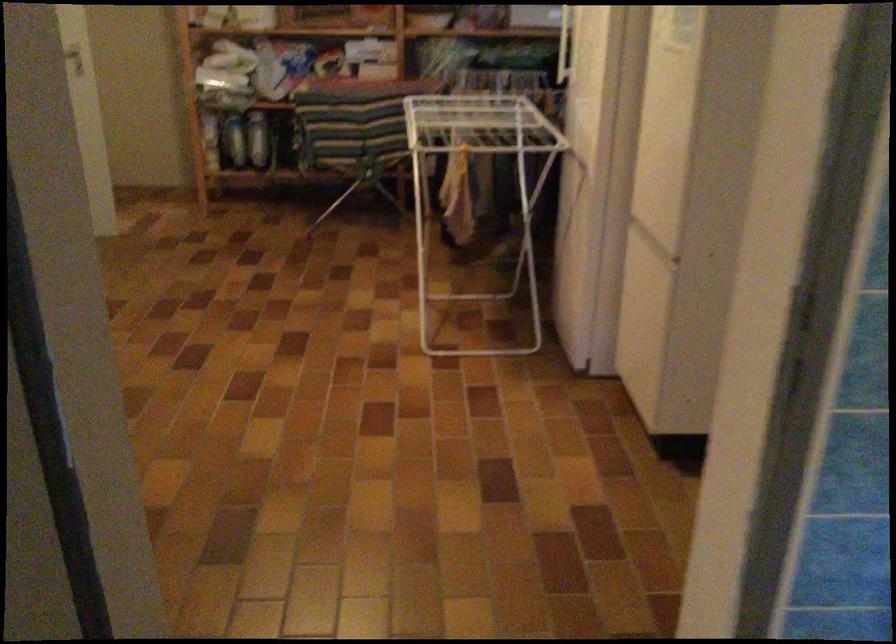
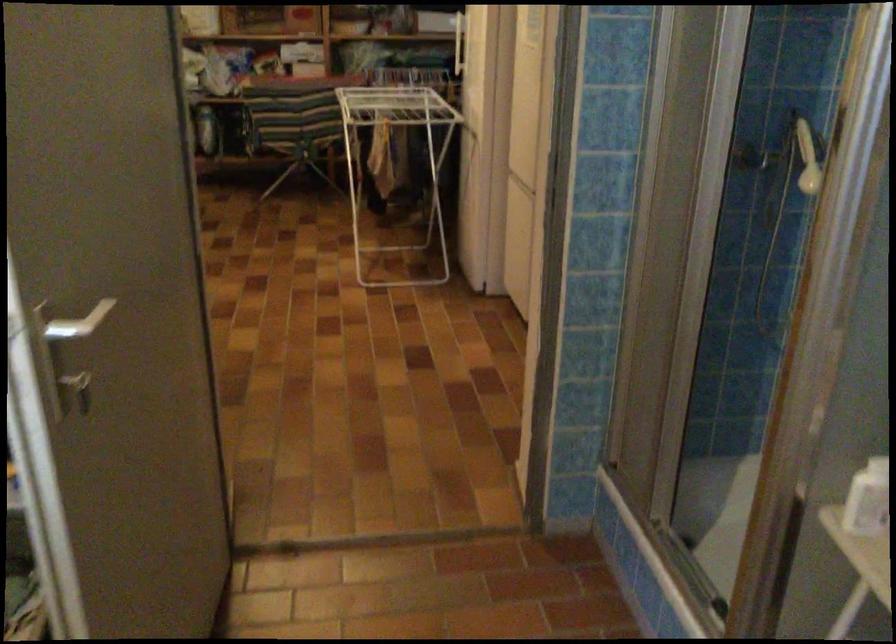
In the second image, find the point that corresponds to pixel 383 140 in the first image.

(306, 128)